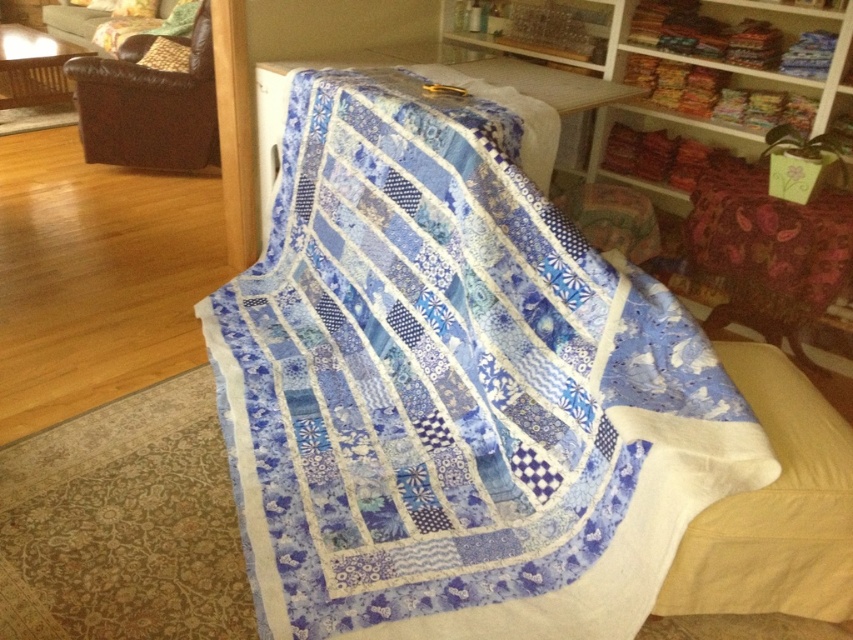
Based on the photo, what is the 2D coordinate of the brown leather armchair at upper left in the image?

The 2D coordinate of the brown leather armchair at upper left is at point [149,104].